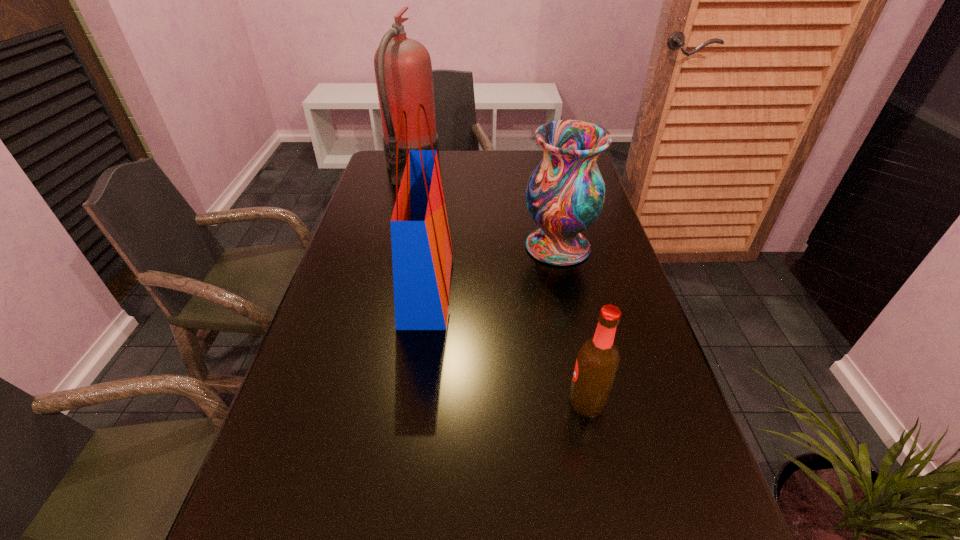
The image size is (960, 540). Find the location of `fire extinguisher`. fire extinguisher is located at coordinates (403, 70).

Locate an element on the screen. shopping bag is located at coordinates (422, 253).

I want to click on vase, so click(x=565, y=194).

The image size is (960, 540). Find the location of `the shortest object`. the shortest object is located at coordinates (597, 362).

You are a GUI agent. You are given a task and a screenshot of the screen. Output one action in this format:
    pyautogui.click(x=<x>, y=<y>)
    Task: Click on the nearest object
    
    Given the screenshot: What is the action you would take?
    pyautogui.click(x=597, y=362)

Identify the location of vacant region located 0.340m at the nozzle of the fire extinguisher. The height and width of the screenshot is (540, 960). (531, 168).

You are a GUI agent. You are given a task and a screenshot of the screen. Output one action in this format:
    pyautogui.click(x=<x>, y=<y>)
    Task: Click on the vacant space located on the handle side of the shopping bag
    
    Given the screenshot: What is the action you would take?
    pyautogui.click(x=580, y=286)

Locate an element on the screen. Image resolution: width=960 pixels, height=540 pixels. free location located on the left of the third tallest object is located at coordinates (427, 246).

Where is `vacant area located on the back of the beer bottle`? This screenshot has width=960, height=540. vacant area located on the back of the beer bottle is located at coordinates [565, 299].

Locate an element on the screen. The width and height of the screenshot is (960, 540). object present at the far edge is located at coordinates (403, 70).